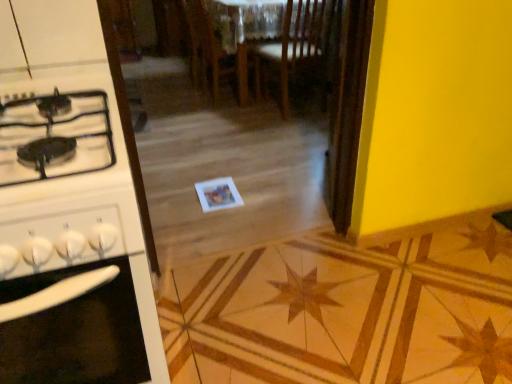
Question: Which direction should I rotate to look at wooden chair at center, which is the second chair from left to right?

Choices:
 (A) left
 (B) right

Answer: (B)

Question: Considering the relative positions of white glossy stove at left and wooden chair at center, acting as the second chair starting from the right, in the image provided, is white glossy stove at left to the left of wooden chair at center, acting as the second chair starting from the right, from the viewer's perspective?

Choices:
 (A) no
 (B) yes

Answer: (B)

Question: Is white glossy stove at left facing away from wooden chair at center, acting as the second chair starting from the right?

Choices:
 (A) yes
 (B) no

Answer: (B)

Question: Is white glossy stove at left taller than wooden chair at center, acting as the second chair starting from the right?

Choices:
 (A) no
 (B) yes

Answer: (A)

Question: Does white glossy stove at left appear on the right side of wooden chair at center, acting as the second chair starting from the right?

Choices:
 (A) yes
 (B) no

Answer: (B)

Question: Is white glossy stove at left not within wooden chair at center, acting as the second chair starting from the right?

Choices:
 (A) yes
 (B) no

Answer: (A)

Question: From a real-world perspective, is white glossy stove at left located beneath wooden chair at center, acting as the second chair starting from the right?

Choices:
 (A) no
 (B) yes

Answer: (B)

Question: Is wooden chair at center, acting as the second chair starting from the right, placed right next to wooden chair at center, which is the 1th chair in right-to-left order?

Choices:
 (A) yes
 (B) no

Answer: (B)

Question: Is the depth of wooden chair at center, which is counted as the 1th chair, starting from the left, greater than that of wooden chair at center, which is the second chair from left to right?

Choices:
 (A) yes
 (B) no

Answer: (A)

Question: Can you confirm if wooden chair at center, which is counted as the 1th chair, starting from the left, is taller than wooden chair at center, which is the second chair from left to right?

Choices:
 (A) no
 (B) yes

Answer: (A)

Question: Is wooden chair at center, which is counted as the 1th chair, starting from the left, turned away from wooden chair at center, which is the 1th chair in right-to-left order?

Choices:
 (A) yes
 (B) no

Answer: (B)

Question: Is the position of wooden chair at center, acting as the second chair starting from the right, less distant than that of wooden chair at center, which is the 1th chair in right-to-left order?

Choices:
 (A) yes
 (B) no

Answer: (B)

Question: Is wooden chair at center, acting as the second chair starting from the right, aimed at wooden chair at center, which is the second chair from left to right?

Choices:
 (A) yes
 (B) no

Answer: (B)

Question: From a real-world perspective, is wooden chair at center, which is the 1th chair in right-to-left order, located higher than wooden chair at center, acting as the second chair starting from the right?

Choices:
 (A) no
 (B) yes

Answer: (B)